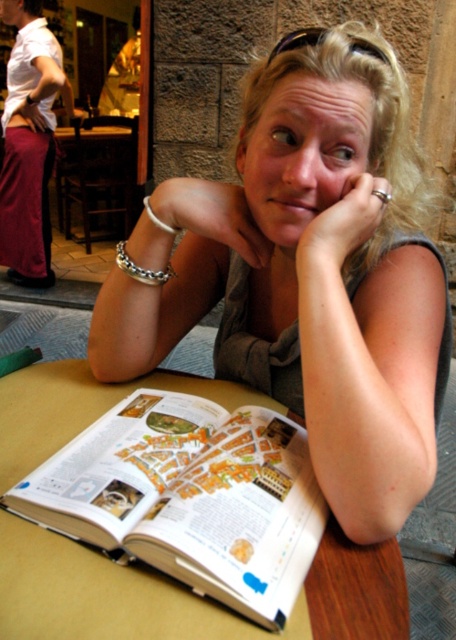
Looking at this image, you are a photographer trying to capture the white paper book at center and the silver metallic bracelet at upper left in a single shot. Based on their positions, which object should you focus on first to ensure both are in frame?

The white paper book at center is in front of the silver metallic bracelet at upper left, so you should focus on the white paper book at center first to ensure both are in frame.